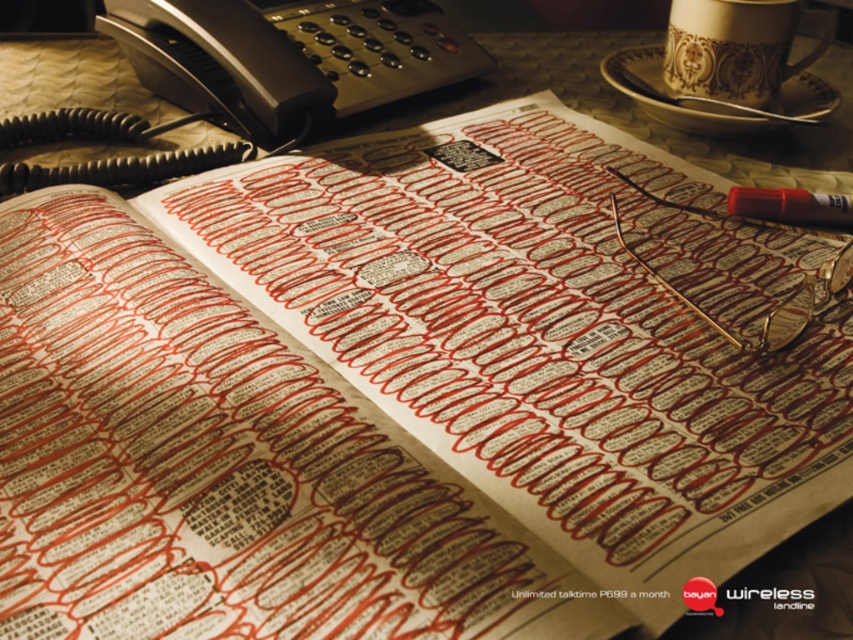
Consider the image. You are a person with limited mobility who needs to reach the black plastic phone at upper left on your desk. Can you comfortably reach it from your current seated position if your arm can extend 22 inches forward?

The black plastic phone at upper left is 21.90 inches from viewer, so yes, you can comfortably reach it since your arm can extend 22 inches forward which is just enough to reach it.

You are organizing items on a desk and need to place a new item between the gold textured coffee cup at upper right and the translucent red pen at upper right. Based on their positions, where should you place the new item?

The gold textured coffee cup at upper right is to the right of the translucent red pen at upper right. Therefore, placing the new item between them would require positioning it to the left of the gold textured coffee cup at upper right and to the right of the translucent red pen at upper right.

You are trying to locate the black plastic phone at upper left on the desk. What are the coordinates where you should look?

The black plastic phone at upper left is located at coordinates point (289, 54).